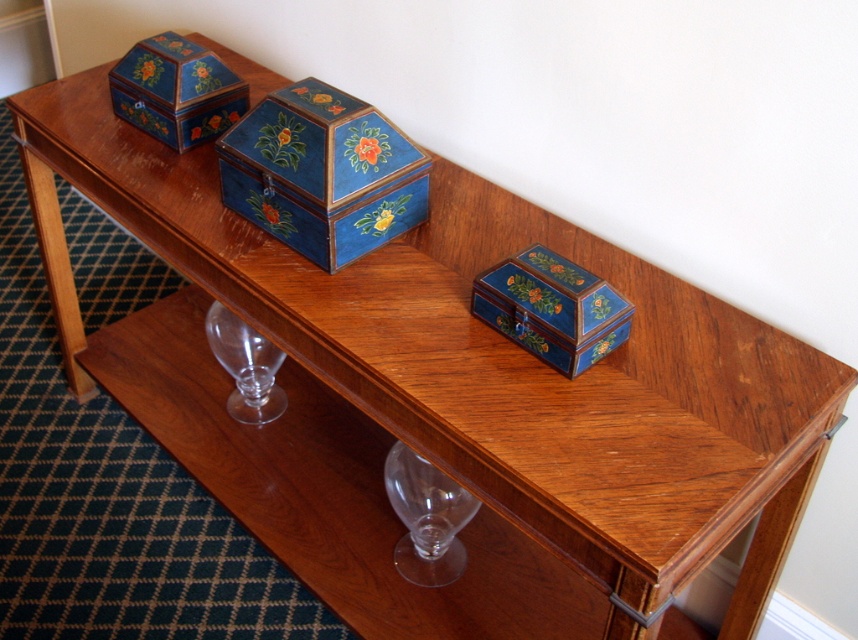
You are organizing a small gift for a friend and need to choose between the matte blue wooden box at center and the blue painted wood box at upper left. Which box should you pick if you want the smaller one?

The matte blue wooden box at center has a smaller size compared to the blue painted wood box at upper left, so you should pick the matte blue wooden box at center.

You are standing in front of the wooden console table and want to place a small vase on the tabletop. The vase needs to be placed exactly at the center of the table. Is the matte blue wooden box at center currently occupying that spot?

The matte blue wooden box at center is located at point (553,308), which corresponds to the center of the table. Therefore, the vase cannot be placed there as the matte blue wooden box at center is already occupying the central position.